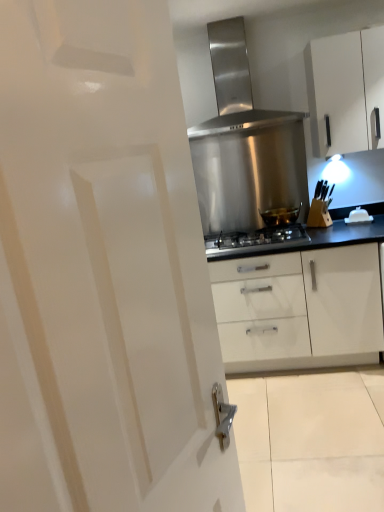
Question: Is shiny metallic pot at center outside of white glossy door at center?

Choices:
 (A) yes
 (B) no

Answer: (A)

Question: From the image's perspective, is shiny metallic pot at center beneath white glossy door at center?

Choices:
 (A) no
 (B) yes

Answer: (A)

Question: Does shiny metallic pot at center have a greater width compared to white glossy door at center?

Choices:
 (A) yes
 (B) no

Answer: (A)

Question: Is shiny metallic pot at center to the right of white glossy door at center from the viewer's perspective?

Choices:
 (A) no
 (B) yes

Answer: (B)

Question: Does shiny metallic pot at center have a greater height compared to white glossy door at center?

Choices:
 (A) no
 (B) yes

Answer: (A)

Question: In the image, is shiny metallic pot at center on the left side or the right side of white glossy door at center?

Choices:
 (A) left
 (B) right

Answer: (B)

Question: Is point (297, 208) positioned closer to the camera than point (79, 19)?

Choices:
 (A) closer
 (B) farther

Answer: (B)

Question: Is shiny metallic pot at center wider or thinner than white glossy door at center?

Choices:
 (A) thin
 (B) wide

Answer: (B)

Question: From a real-world perspective, is shiny metallic pot at center above or below white glossy door at center?

Choices:
 (A) above
 (B) below

Answer: (B)

Question: In terms of size, does white glossy cabinet at upper right appear bigger or smaller than white glossy door at center?

Choices:
 (A) small
 (B) big

Answer: (A)

Question: Looking at their shapes, would you say white glossy cabinet at upper right is wider or thinner than white glossy door at center?

Choices:
 (A) wide
 (B) thin

Answer: (A)

Question: From a real-world perspective, is white glossy cabinet at upper right above or below white glossy door at center?

Choices:
 (A) above
 (B) below

Answer: (A)

Question: From the image's perspective, is white glossy cabinet at upper right located above or below white glossy door at center?

Choices:
 (A) below
 (B) above

Answer: (B)

Question: Is white glossy cabinet at upper right in front of or behind shiny metallic pot at center in the image?

Choices:
 (A) front
 (B) behind

Answer: (A)

Question: In terms of height, does white glossy cabinet at upper right look taller or shorter compared to shiny metallic pot at center?

Choices:
 (A) short
 (B) tall

Answer: (B)